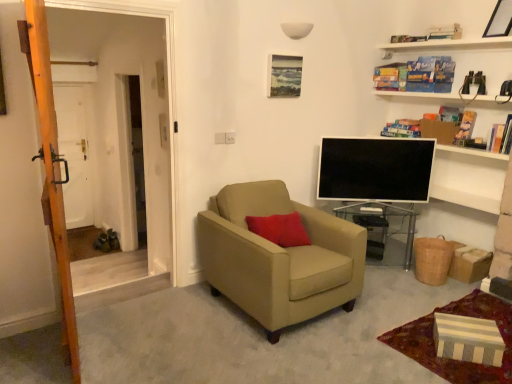
Where is `unoccupied area in front of beige fabric armchair at center`? unoccupied area in front of beige fabric armchair at center is located at coordinates [x=289, y=350].